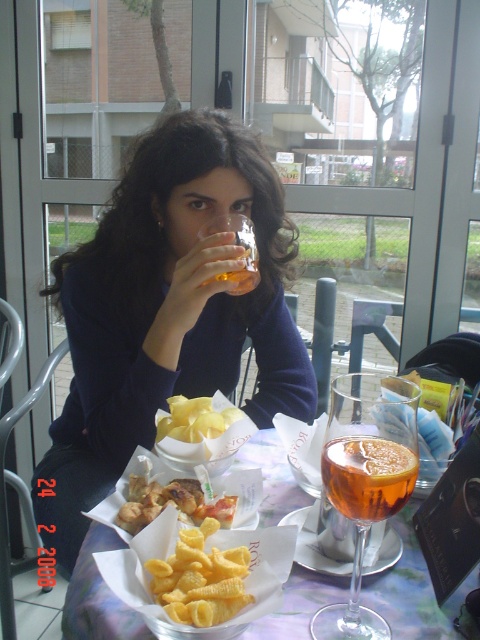
Which is below, translucent glass at center or yellow crispy pasta at center?

yellow crispy pasta at center is lower down.

Identify the location of translucent glass at center. The width and height of the screenshot is (480, 640). (365, 480).

Where is `translucent glass at center`? The height and width of the screenshot is (640, 480). translucent glass at center is located at coordinates (365, 480).

This screenshot has width=480, height=640. I want to click on translucent glass at center, so click(365, 480).

How far apart are translucent glass drink at center and golden crispy fries at center?

translucent glass drink at center and golden crispy fries at center are 20.17 centimeters apart.

Describe the element at coordinates (368, 476) in the screenshot. I see `translucent glass drink at center` at that location.

Where is `translucent glass drink at center`? translucent glass drink at center is located at coordinates (368, 476).

Is point (276, 276) positioned after point (162, 490)?

Yes, it is behind point (162, 490).

What are the coordinates of `matte black sweater at center` in the screenshot? It's located at (167, 310).

This screenshot has height=640, width=480. In order to click on matte black sweater at center in this screenshot , I will do `click(167, 310)`.

This screenshot has width=480, height=640. Find the location of `matte black sweater at center`. matte black sweater at center is located at coordinates (167, 310).